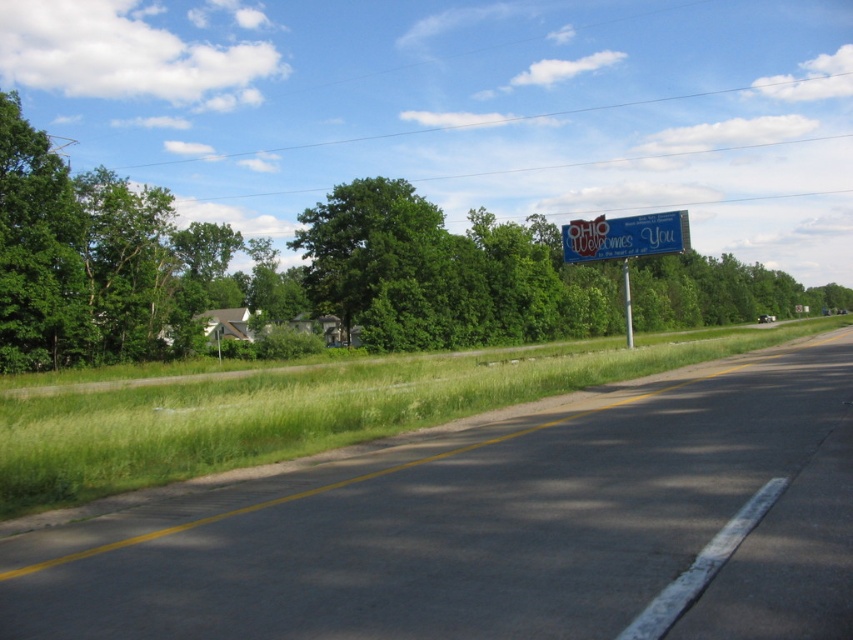
Based on the photo, who is shorter, blue plastic billboard at upper right or metallic pole at right?

blue plastic billboard at upper right

Which is behind, point (630, 221) or point (628, 324)?

Positioned behind is point (628, 324).

The width and height of the screenshot is (853, 640). Identify the location of blue plastic billboard at upper right. (625, 236).

Identify the location of green leafy tree at upper center. (262, 268).

Can you confirm if green leafy tree at upper center is positioned to the right of blue plastic billboard at upper right?

In fact, green leafy tree at upper center is to the left of blue plastic billboard at upper right.

Is point (67, 289) farther from viewer compared to point (590, 248)?

No.

Locate an element on the screen. green leafy tree at upper center is located at coordinates (262, 268).

Can you confirm if blue painted metal sign at right is positioned to the right of metallic pole at right?

In fact, blue painted metal sign at right is to the left of metallic pole at right.

Looking at this image, which is above, blue painted metal sign at right or metallic pole at right?

blue painted metal sign at right is higher up.

The width and height of the screenshot is (853, 640). I want to click on blue painted metal sign at right, so click(625, 243).

Locate an element on the screen. The image size is (853, 640). blue painted metal sign at right is located at coordinates (625, 243).